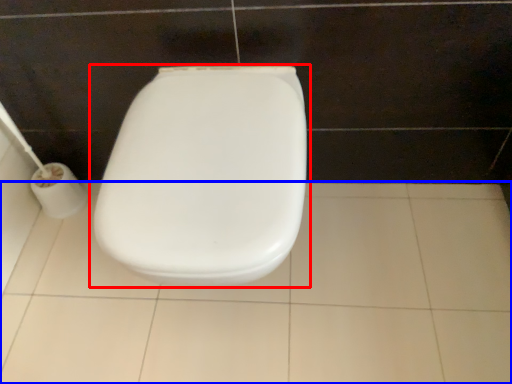
Question: Which of the following is the closest to the observer, toilet (highlighted by a red box) or ceramic tile (highlighted by a blue box)?

Choices:
 (A) toilet
 (B) ceramic tile

Answer: (A)